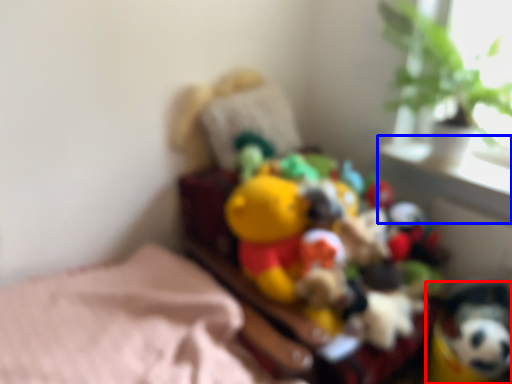
Question: Which object appears farthest to the camera in this image, toy (highlighted by a red box) or window sill (highlighted by a blue box)?

Choices:
 (A) toy
 (B) window sill

Answer: (B)